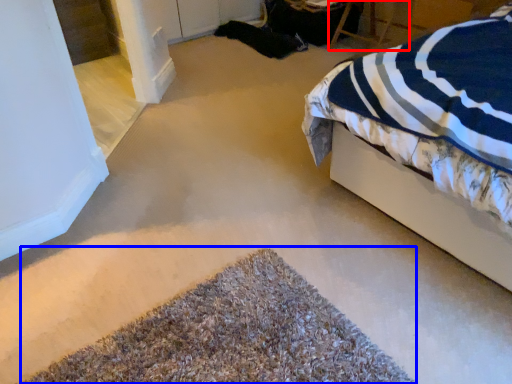
Question: Which object appears farthest to the camera in this image, chair (highlighted by a red box) or door (highlighted by a blue box)?

Choices:
 (A) chair
 (B) door

Answer: (A)